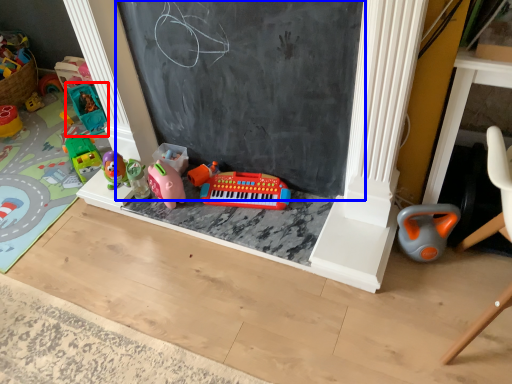
Question: Which of the following is the farthest to the observer, toy (highlighted by a red box) or bulletin board (highlighted by a blue box)?

Choices:
 (A) toy
 (B) bulletin board

Answer: (A)